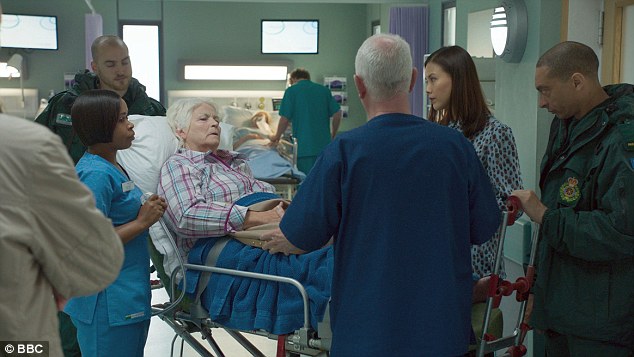
Find the location of a particular element. tv screen is located at coordinates (278, 35).